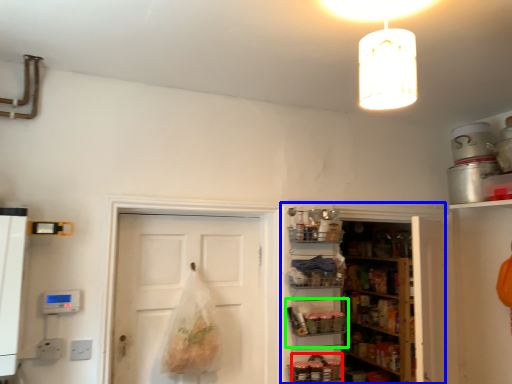
Question: Which is farther away from food (highlighted by a red box)? cabinetry (highlighted by a blue box) or shelf (highlighted by a green box)?

Choices:
 (A) cabinetry
 (B) shelf

Answer: (A)